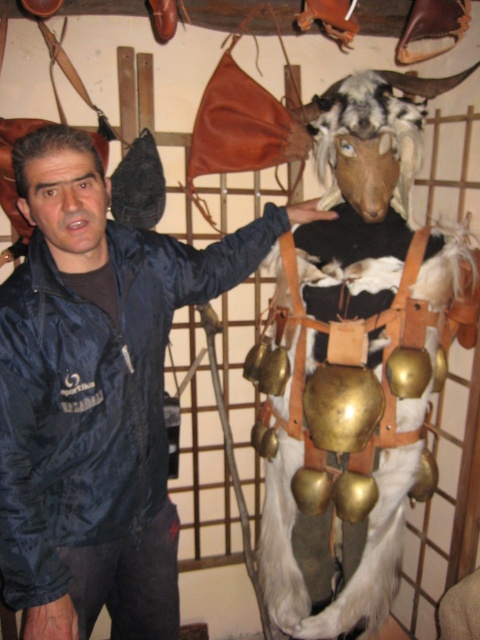
You are a photographer trying to capture the mounted goat head in the scene. You notice two points marked in the image. The first point is at coordinates point (x=238, y=282) and the second is at point (x=393, y=483). Which point should you focus on to ensure the mounted goat head is in sharp focus?

You should focus on point (x=238, y=282) because it is closer to the camera than point (x=393, y=483), ensuring the mounted goat head is in sharp focus.

You are a photographer setting up for a portrait. The subject is wearing a matte black jacket at center. You want to ensure the jacket is in focus while the mounted goat head in the background is slightly blurred. Based on the scene description, what is the minimum distance you should set your camera focus to achieve this effect?

The matte black jacket at center is 4.05 feet from the camera, so you should set the focus distance to at least 4.05 feet to ensure the jacket is in focus while the background remains blurred.

You are a photographer trying to capture a clear shot of the white fur animal at center. However, there is a matte black jacket at center blocking your view. Based on the scene description, can you adjust your position to avoid the jacket and still see the animal?

The matte black jacket at center is in front of the white fur animal at center, so moving to the side or adjusting your angle could allow you to see around the jacket and still view the animal.